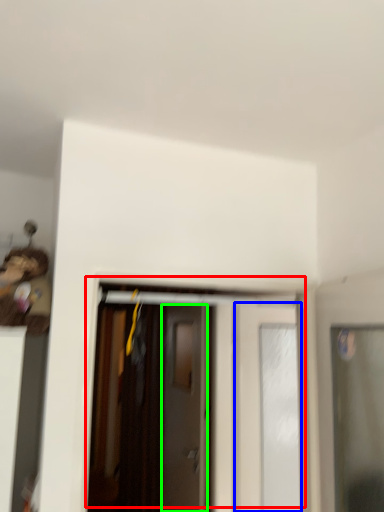
Question: Which object is the closest to the door (highlighted by a red box)? Choose among these: door (highlighted by a blue box) or door (highlighted by a green box).

Choices:
 (A) door
 (B) door

Answer: (B)